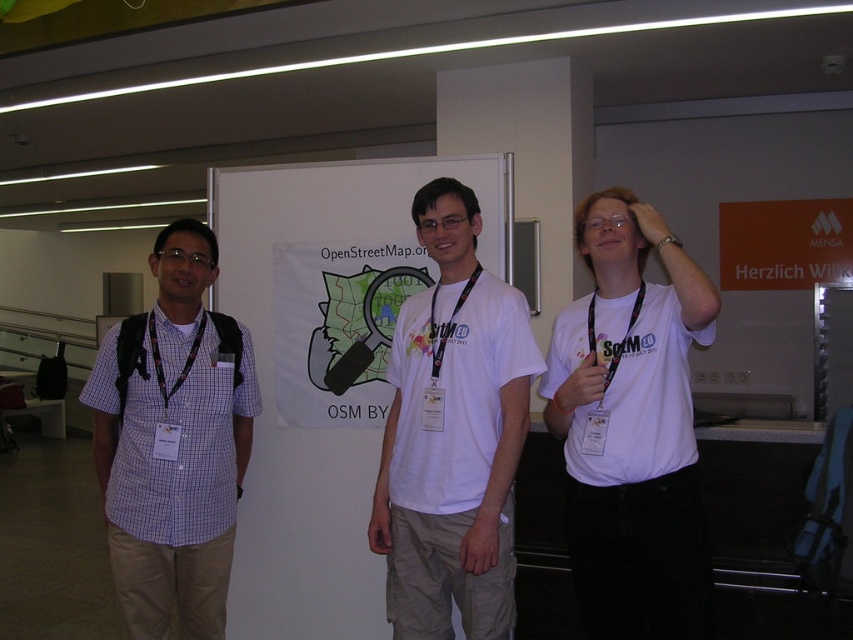
You are at the OpenStreetMap conference and want to move from your current position to the exit, which is located near the point at coordinates (x=111, y=481). There is an obstacle at point (x=636, y=387). Can you go around the obstacle by moving behind it towards the exit?

Point (x=636, y=387) is in front of point (x=111, y=481), so the obstacle is blocking the path to the exit. You cannot go around the obstacle by moving behind it towards the exit because the obstacle is already in front of the exit.